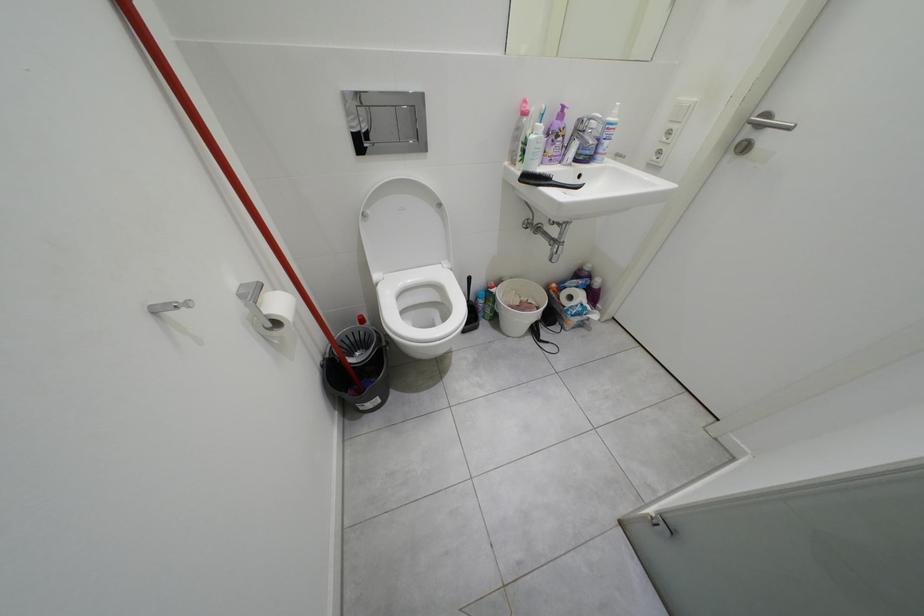
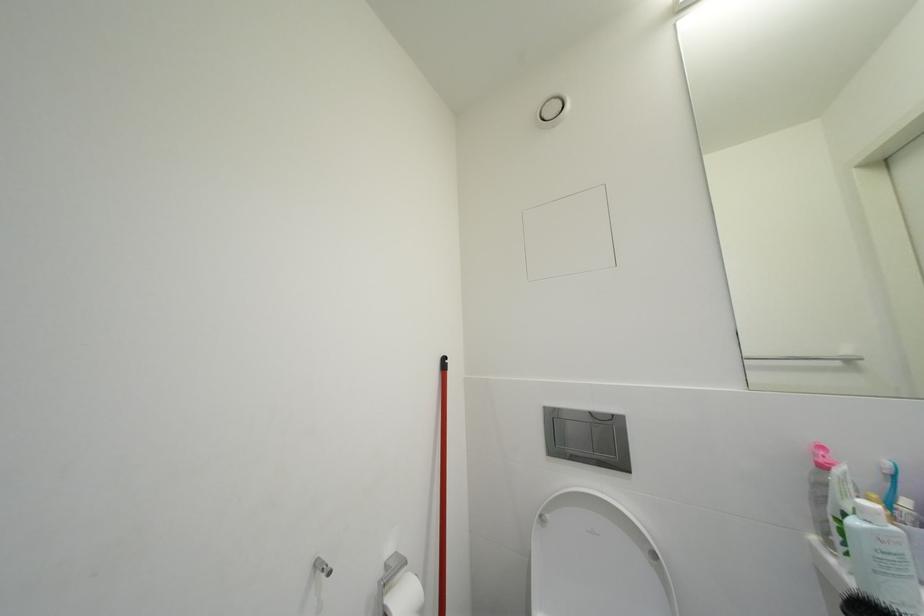
First-person continuous shooting, in which direction is the camera rotating?

The camera rotated toward left-up.